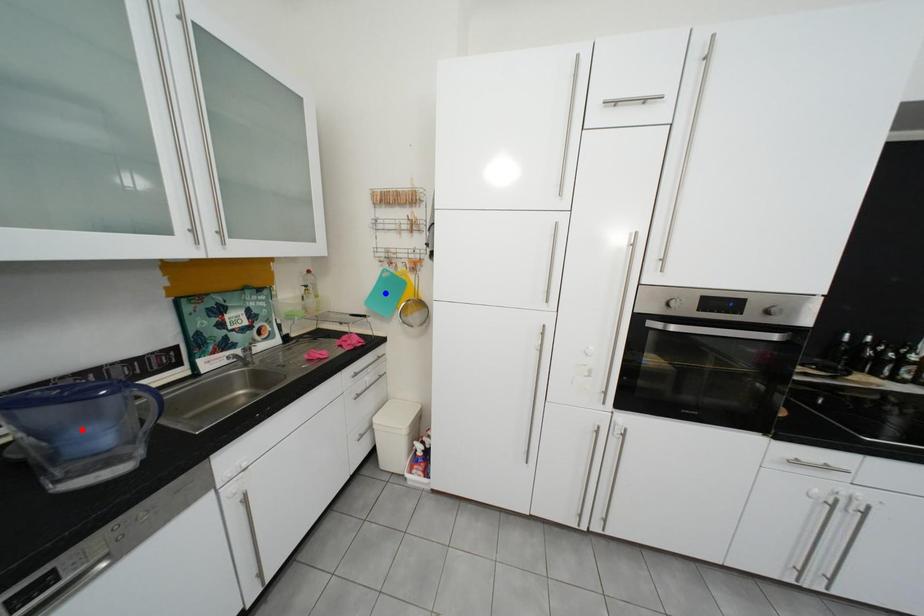
Question: Which of the two points in the image is closer to the camera?

Choices:
 (A) Blue point is closer.
 (B) Red point is closer.

Answer: (B)